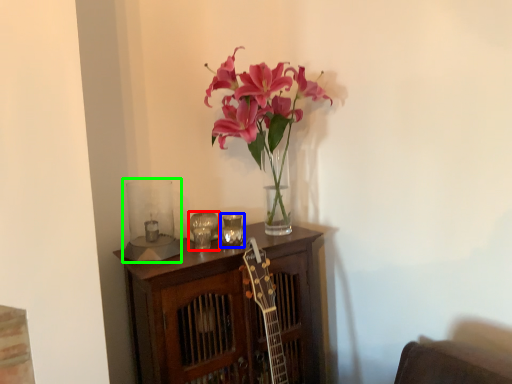
Question: Which object is the closest to the candle holder (highlighted by a red box)? Choose among these: candle holder (highlighted by a blue box) or candle holder (highlighted by a green box).

Choices:
 (A) candle holder
 (B) candle holder

Answer: (A)